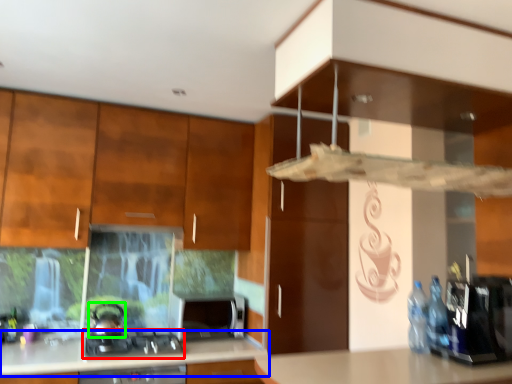
Question: Which is nearer to the gas stove (highlighted by a red box)? countertop (highlighted by a blue box) or kitchen appliance (highlighted by a green box).

Choices:
 (A) countertop
 (B) kitchen appliance

Answer: (B)